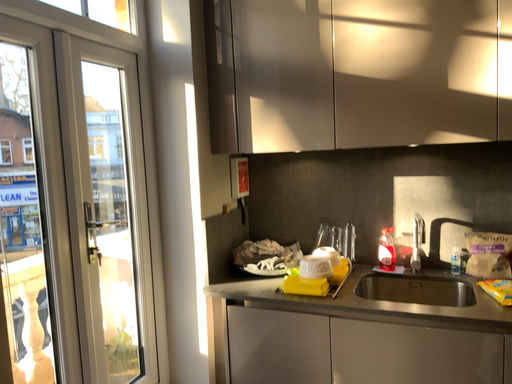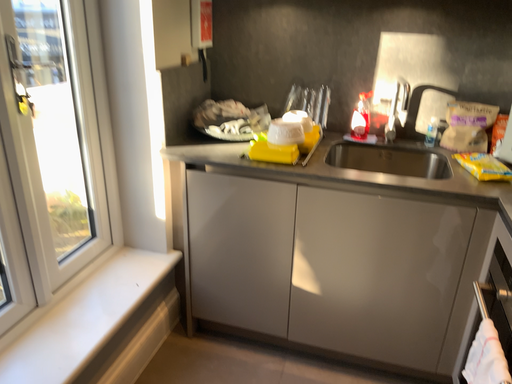
Question: Which way did the camera rotate in the video?

Choices:
 (A) rotated downward
 (B) rotated upward

Answer: (A)